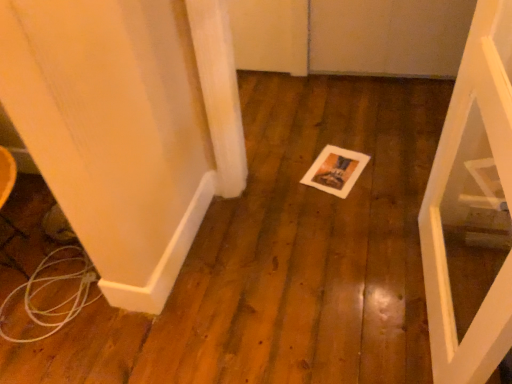
Question: Is point (313, 170) closer or farther from the camera than point (431, 319)?

Choices:
 (A) farther
 (B) closer

Answer: (A)

Question: Which is correct: white paper at center is inside white matte door at center, or outside of it?

Choices:
 (A) outside
 (B) inside

Answer: (A)

Question: Looking at the image, does white paper at center seem bigger or smaller compared to white matte door at center?

Choices:
 (A) big
 (B) small

Answer: (B)

Question: Looking at their shapes, would you say white matte door at center is wider or thinner than white paper at center?

Choices:
 (A) wide
 (B) thin

Answer: (B)

Question: Is white matte door at center in front of or behind white paper at center in the image?

Choices:
 (A) front
 (B) behind

Answer: (A)

Question: From a real-world perspective, is white matte door at center above or below white paper at center?

Choices:
 (A) below
 (B) above

Answer: (B)

Question: From the image's perspective, is white matte door at center located above or below white paper at center?

Choices:
 (A) below
 (B) above

Answer: (A)